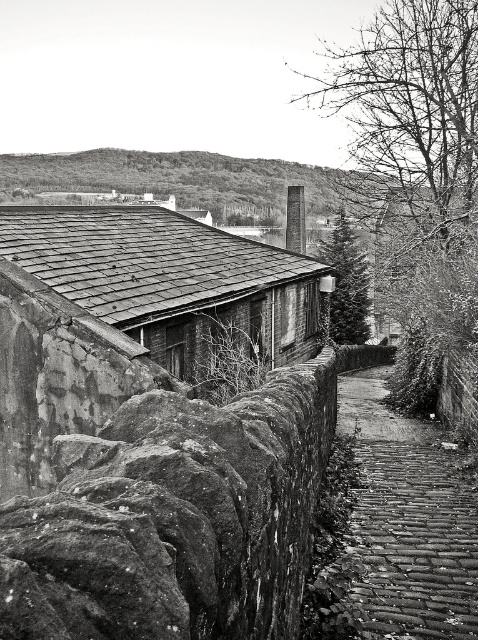
You are standing at the starting point of the cobblestone path in the image. You want to walk towards the wooden shingles hut at center. Which direction should you walk relative to the path?

The wooden shingles hut at center is located at point coordinates, so you should walk along the path towards the center of the image.

You are a photographer standing at the edge of the cobblestone path. You want to capture a photo that includes both the wooden shingles hut at center and the green textured pine tree at center. Based on their sizes, which object should you position closer to the camera to ensure both fit in the frame?

The wooden shingles hut at center might be wider than the green textured pine tree at center, so positioning the wider wooden shingles hut at center closer to the camera would help both objects fit within the frame by adjusting their relative sizes in the composition.